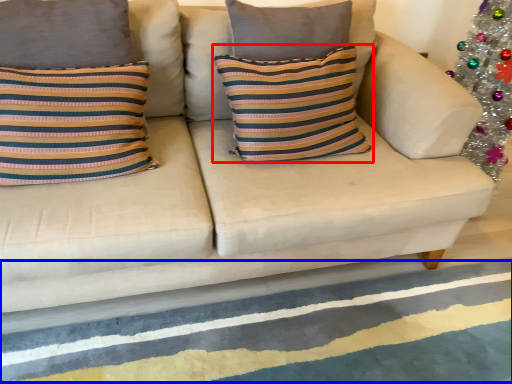
Question: Which point is closer to the camera, pillow (highlighted by a red box) or stripe (highlighted by a blue box)?

Choices:
 (A) pillow
 (B) stripe

Answer: (B)